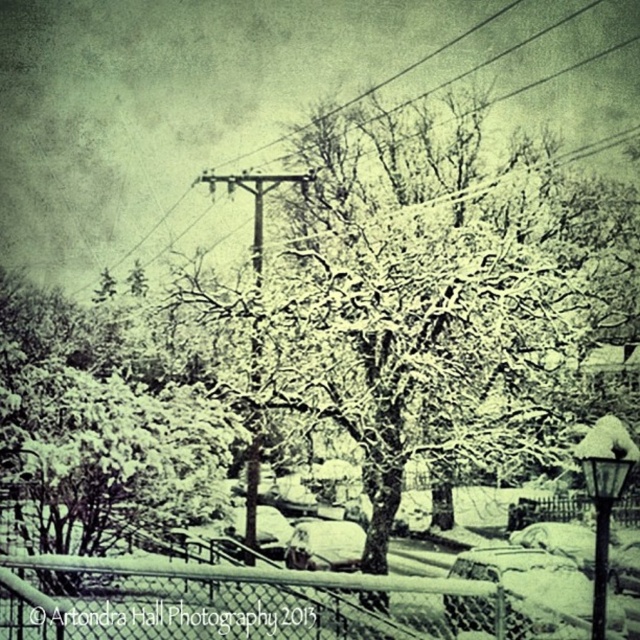
Is snow-covered wire at upper center thinner than wooden telegraph pole at center?

No, snow-covered wire at upper center is not thinner than wooden telegraph pole at center.

Is point (308, 92) farther from camera compared to point (216, 179)?

Yes, it is.

You are a GUI agent. You are given a task and a screenshot of the screen. Output one action in this format:
    pyautogui.click(x=<x>, y=<y>)
    Task: Click on the snow-covered wire at upper center
    This screenshot has height=640, width=640.
    Given the screenshot: What is the action you would take?
    pyautogui.click(x=256, y=104)

Between wooden chain-link fence at lower center and wooden telegraph pole at center, which one is positioned higher?

wooden telegraph pole at center

Who is more forward, (x=196, y=621) or (x=257, y=266)?

Point (x=196, y=621) is more forward.

Locate an element on the screen. This screenshot has height=640, width=640. wooden chain-link fence at lower center is located at coordinates (246, 602).

Looking at this image, is snow-covered wire at upper center closer to camera compared to wooden chain-link fence at lower center?

No, it is behind wooden chain-link fence at lower center.

Does point (506, 26) come in front of point (186, 630)?

No, (506, 26) is further to viewer.

This screenshot has width=640, height=640. Describe the element at coordinates (256, 104) in the screenshot. I see `snow-covered wire at upper center` at that location.

Locate an element on the screen. snow-covered wire at upper center is located at coordinates pos(256,104).